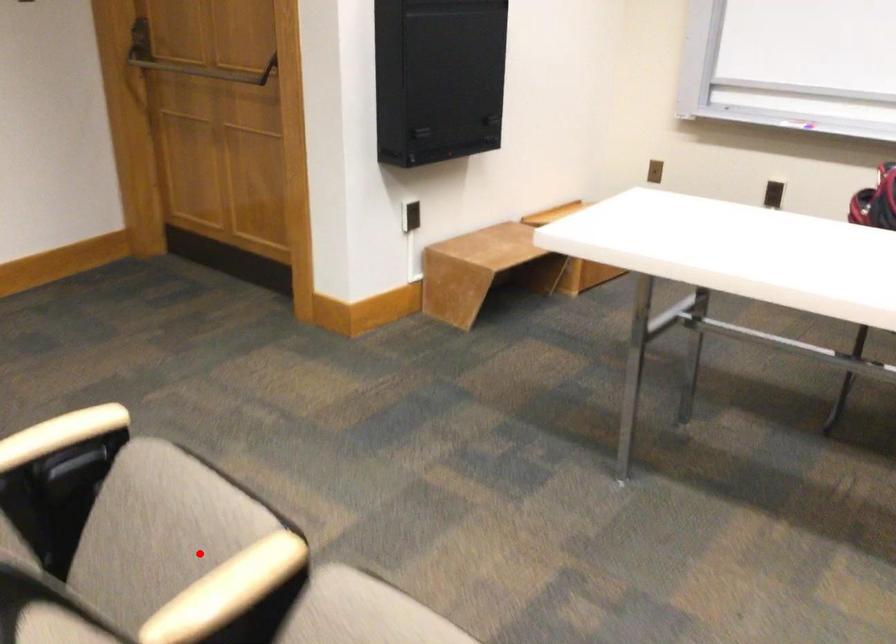
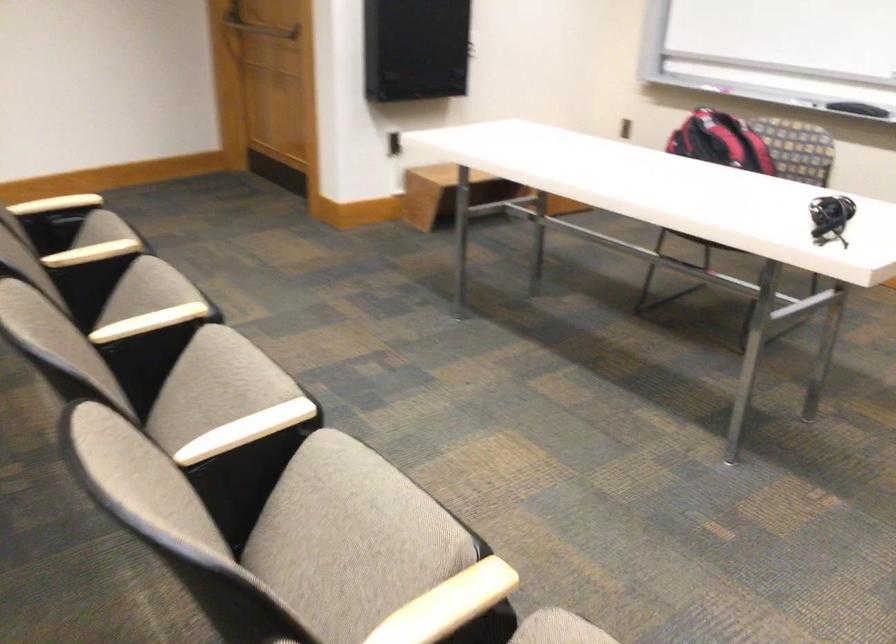
Question: I am providing you with two images of the same scene from different viewpoints. In image1, a red point is highlighted. Considering the same 3D point in image2, which of the following is correct?

Choices:
 (A) It is closer
 (B) It is farther

Answer: (B)